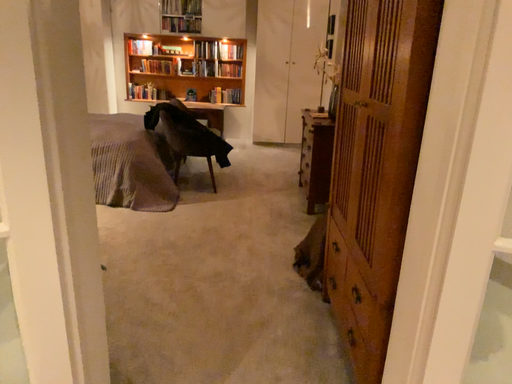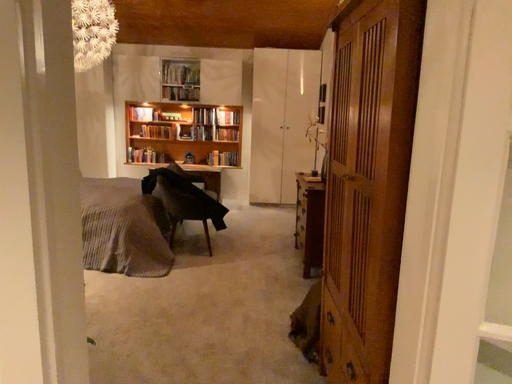
Question: How did the camera likely rotate when shooting the video?

Choices:
 (A) rotated upward
 (B) rotated downward

Answer: (A)